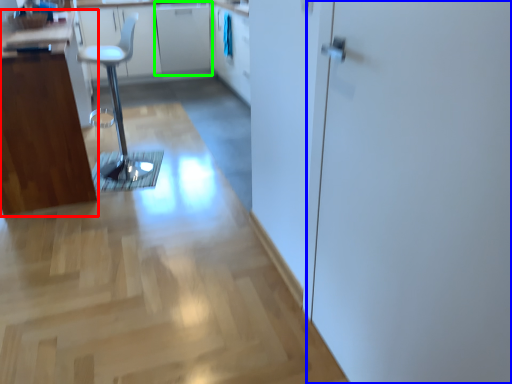
Question: Which object is positioned closest to cabinetry (highlighted by a red box)? Select from screen door (highlighted by a blue box) and cabinetry (highlighted by a green box).

Choices:
 (A) screen door
 (B) cabinetry

Answer: (A)